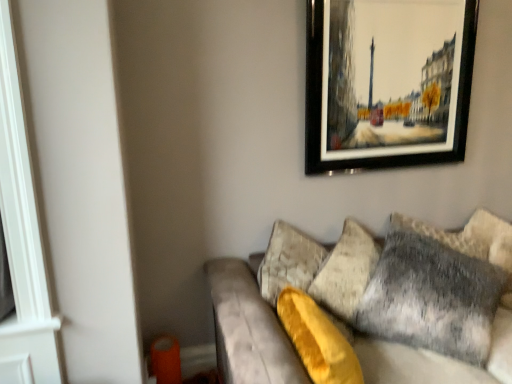
Describe the element at coordinates (432, 297) in the screenshot. The width and height of the screenshot is (512, 384). I see `gray furry pillow at right` at that location.

In order to face velvet gray couch at lower right, should I rotate leftwards or rightwards?

You should look right and rotate roughly 22.800 degrees.

Find the location of a particular element. gray furry pillow at right is located at coordinates (432, 297).

Is gray furry pillow at right surrounding black-framed painting at upper right?

No, gray furry pillow at right does not contain black-framed painting at upper right.

In the scene shown: Is gray furry pillow at right oriented towards black-framed painting at upper right?

No, gray furry pillow at right is not facing towards black-framed painting at upper right.

This screenshot has height=384, width=512. In order to click on pillow on the right of black-framed painting at upper right in this screenshot , I will do `click(432, 297)`.

Considering the sizes of gray furry pillow at right and black-framed painting at upper right in the image, is gray furry pillow at right bigger or smaller than black-framed painting at upper right?

In the image, gray furry pillow at right appears to be larger than black-framed painting at upper right.

How different are the orientations of velvet gray couch at lower right and gray furry pillow at right in degrees?

There is a 36.3-degree angle between the facing directions of velvet gray couch at lower right and gray furry pillow at right.

From the image's perspective, who appears lower, velvet gray couch at lower right or gray furry pillow at right?

velvet gray couch at lower right appears lower in the image.

From a real-world perspective, between velvet gray couch at lower right and gray furry pillow at right, who is vertically higher?

In real-world perspective, gray furry pillow at right is above.

Which object is positioned more to the right, velvet gray couch at lower right or gray furry pillow at right?

velvet gray couch at lower right is more to the right.

Considering the positions of point (380, 152) and point (408, 250), is point (380, 152) closer or farther from the camera than point (408, 250)?

Point (380, 152).

Which is in front, black-framed painting at upper right or gray furry pillow at right?

gray furry pillow at right is closer to the camera.

From a real-world perspective, which object rests below the other?

In real-world perspective, gray furry pillow at right is lower.

Considering the sizes of objects black-framed painting at upper right and gray furry pillow at right in the image provided, who is wider, black-framed painting at upper right or gray furry pillow at right?

gray furry pillow at right is wider.

Image resolution: width=512 pixels, height=384 pixels. I want to click on picture frame that is above the velvet gray couch at lower right (from the image's perspective), so click(387, 83).

In the image, is velvet gray couch at lower right positioned in front of or behind black-framed painting at upper right?

velvet gray couch at lower right is in front of black-framed painting at upper right.

From the image's perspective, relative to black-framed painting at upper right, is velvet gray couch at lower right above or below?

Clearly, from the image's perspective, velvet gray couch at lower right is below black-framed painting at upper right.

From the image's perspective, does black-framed painting at upper right appear lower than velvet gray couch at lower right?

No.

How different are the orientations of black-framed painting at upper right and velvet gray couch at lower right in degrees?

There is a 0.000257-degree angle between the facing directions of black-framed painting at upper right and velvet gray couch at lower right.

Is point (439, 134) closer or farther from the camera than point (323, 283)?

Point (439, 134) appears to be farther away from the viewer than point (323, 283).

Is gray furry pillow at right facing towards velvet gray couch at lower right?

Yes, gray furry pillow at right is facing velvet gray couch at lower right.

Is point (384, 259) positioned before point (352, 311)?

No, (384, 259) is further to viewer.

From a real-world perspective, who is located lower, gray furry pillow at right or velvet gray couch at lower right?

velvet gray couch at lower right, from a real-world perspective.

Does gray furry pillow at right have a greater width compared to velvet gray couch at lower right?

Incorrect, the width of gray furry pillow at right does not surpass that of velvet gray couch at lower right.

This screenshot has height=384, width=512. There is a gray furry pillow at right. What are the coordinates of `picture frame above it (from a real-world perspective)` in the screenshot? It's located at (387, 83).

Find the location of `studio couch in front of the gray furry pillow at right`. studio couch in front of the gray furry pillow at right is located at coordinates click(x=277, y=297).

From the image, which object appears to be farther from velvet gray couch at lower right, black-framed painting at upper right or gray furry pillow at right?

black-framed painting at upper right is further to velvet gray couch at lower right.

From the image, which object appears to be farther from gray furry pillow at right, black-framed painting at upper right or velvet gray couch at lower right?

The object further to gray furry pillow at right is black-framed painting at upper right.

Considering their positions, is velvet gray couch at lower right positioned closer to black-framed painting at upper right than gray furry pillow at right?

velvet gray couch at lower right is positioned closer to the anchor black-framed painting at upper right.

Considering their positions, is velvet gray couch at lower right positioned closer to gray furry pillow at right than black-framed painting at upper right?

velvet gray couch at lower right is positioned closer to the anchor gray furry pillow at right.

Based on their spatial positions, is gray furry pillow at right or velvet gray couch at lower right closer to black-framed painting at upper right?

Among the two, velvet gray couch at lower right is located nearer to black-framed painting at upper right.

Estimate the real-world distances between objects in this image. Which object is closer to velvet gray couch at lower right, gray furry pillow at right or black-framed painting at upper right?

gray furry pillow at right.

Where is `pillow between black-framed painting at upper right and velvet gray couch at lower right from top to bottom`? pillow between black-framed painting at upper right and velvet gray couch at lower right from top to bottom is located at coordinates (432, 297).